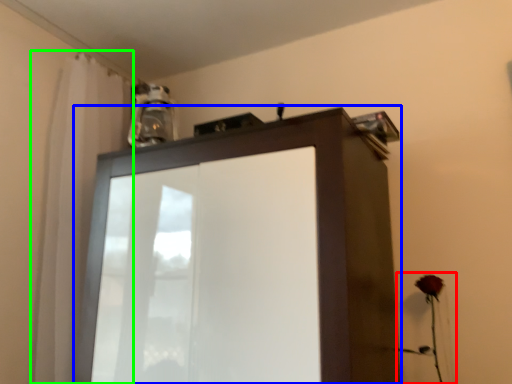
Question: Estimate the real-world distances between objects in this image. Which object is closer to flower (highlighted by a red box), cupboard (highlighted by a blue box) or shower curtain (highlighted by a green box)?

Choices:
 (A) cupboard
 (B) shower curtain

Answer: (A)